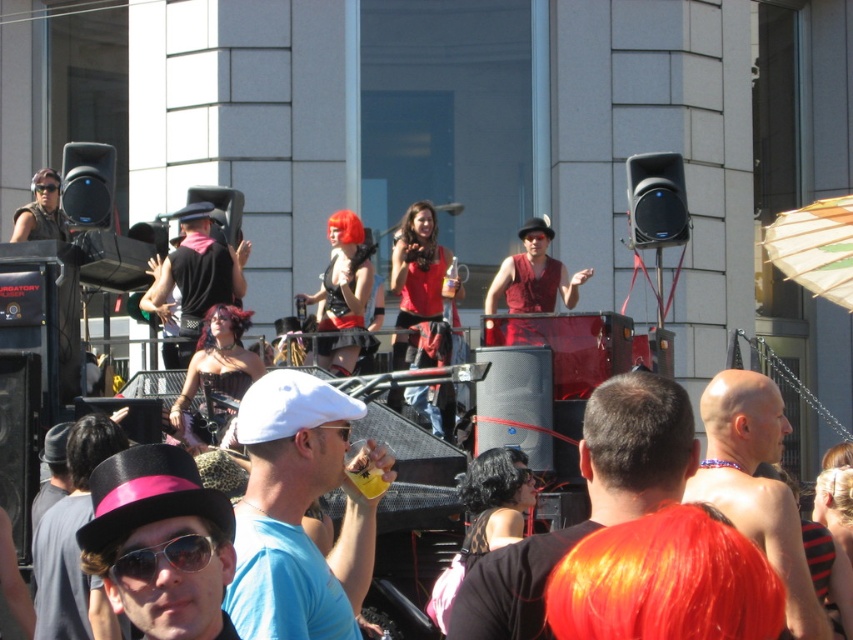
Question: Which point is closer to the camera?

Choices:
 (A) white matte cap at center
 (B) matte black shirt at center
 (C) sunglasses at center
 (D) shiny black hat at lower left

Answer: (C)

Question: Considering the real-world distances, which object is farthest from the sunglasses at center?

Choices:
 (A) brushed metal goggles at upper center
 (B) matte black shirt at center

Answer: (A)

Question: Which point is closer to the camera?

Choices:
 (A) shiny black hat at center
 (B) pink felt top hat at lower left
 (C) bald head at center
 (D) matte black shirt at center

Answer: (B)

Question: Does shiny black hat at center have a larger size compared to bald head at center?

Choices:
 (A) no
 (B) yes

Answer: (A)

Question: Is white matte cap at center thinner than shiny black hat at lower left?

Choices:
 (A) yes
 (B) no

Answer: (A)

Question: Can you confirm if white matte cap at center is positioned above matte black shirt at center?

Choices:
 (A) no
 (B) yes

Answer: (A)